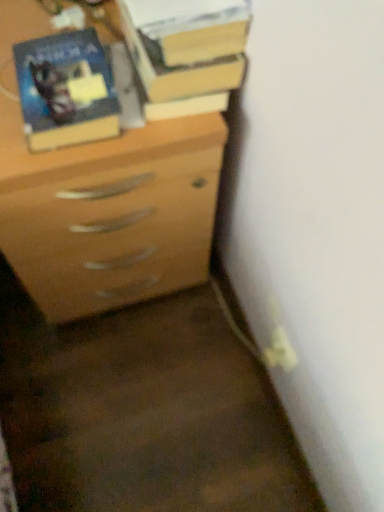
Where is `matte black book at upper left`? The image size is (384, 512). matte black book at upper left is located at coordinates (66, 90).

From the picture: Measure the distance between matte black book at upper left and camera.

The distance of matte black book at upper left from camera is 24.69 inches.

This screenshot has width=384, height=512. What do you see at coordinates (186, 52) in the screenshot? I see `hardcover book at upper center` at bounding box center [186, 52].

Identify the location of matte wood chest of drawers at center. The image size is (384, 512). (109, 213).

Who is smaller, matte wood chest of drawers at center or hardcover book at upper center?

Smaller between the two is hardcover book at upper center.

Measure the distance from matte wood chest of drawers at center to hardcover book at upper center.

A distance of 9.17 inches exists between matte wood chest of drawers at center and hardcover book at upper center.

At what (x,y) coordinates should I click in order to perform the action: click on book that is behind the matte wood chest of drawers at center. Please return your answer as a coordinate pair (x, y). The height and width of the screenshot is (512, 384). Looking at the image, I should click on (186, 52).

Which of these two, matte wood chest of drawers at center or matte black book at upper left, is smaller?

With smaller size is matte black book at upper left.

Consider the image. Is matte wood chest of drawers at center touching matte black book at upper left?

matte wood chest of drawers at center and matte black book at upper left are not in contact.

Is matte wood chest of drawers at center aimed at matte black book at upper left?

No.

Can you tell me how much matte black book at upper left and matte wood chest of drawers at center differ in facing direction?

The angular difference between matte black book at upper left and matte wood chest of drawers at center is 0.149 degrees.

Based on the photo, is matte black book at upper left not within matte wood chest of drawers at center?

Yes, matte black book at upper left is not within matte wood chest of drawers at center.

Who is shorter, matte black book at upper left or matte wood chest of drawers at center?

matte black book at upper left.

Does matte black book at upper left have a greater width compared to matte wood chest of drawers at center?

Incorrect, the width of matte black book at upper left does not surpass that of matte wood chest of drawers at center.

Would you say matte black book at upper left is a long distance from hardcover book at upper center?

They are positioned close to each other.

Can hardcover book at upper center be found inside matte black book at upper left?

Actually, hardcover book at upper center is outside matte black book at upper left.

Is matte black book at upper left to the right of hardcover book at upper center from the viewer's perspective?

No.

Can you tell me how much hardcover book at upper center and matte wood chest of drawers at center differ in facing direction?

The facing directions of hardcover book at upper center and matte wood chest of drawers at center are 0.437 degrees apart.

Considering the sizes of objects hardcover book at upper center and matte wood chest of drawers at center in the image provided, who is smaller, hardcover book at upper center or matte wood chest of drawers at center?

hardcover book at upper center.

Could you tell me if hardcover book at upper center is turned towards matte wood chest of drawers at center?

No, hardcover book at upper center is not oriented towards matte wood chest of drawers at center.

Which object is closer to the camera, hardcover book at upper center or matte wood chest of drawers at center?

matte wood chest of drawers at center is in front.

Is hardcover book at upper center closer to camera compared to matte black book at upper left?

No, hardcover book at upper center is behind matte black book at upper left.

Looking at this image, is hardcover book at upper center wider or thinner than matte black book at upper left?

In the image, hardcover book at upper center appears to be wider than matte black book at upper left.

Is hardcover book at upper center situated inside matte black book at upper left or outside?

hardcover book at upper center lies outside matte black book at upper left.

This screenshot has width=384, height=512. I want to click on book behind the matte wood chest of drawers at center, so click(186, 52).

Where is `chest of drawers below the matte black book at upper left (from a real-world perspective)`? This screenshot has height=512, width=384. chest of drawers below the matte black book at upper left (from a real-world perspective) is located at coordinates (109, 213).

Consider the image. Looking at the image, which one is located closer to hardcover book at upper center, matte wood chest of drawers at center or matte black book at upper left?

matte black book at upper left.

Based on their spatial positions, is matte wood chest of drawers at center or hardcover book at upper center closer to matte black book at upper left?

hardcover book at upper center.

From the image, which object appears to be nearer to hardcover book at upper center, matte black book at upper left or matte wood chest of drawers at center?

The object closer to hardcover book at upper center is matte black book at upper left.

Looking at the image, which one is located further to matte black book at upper left, hardcover book at upper center or matte wood chest of drawers at center?

Among the two, matte wood chest of drawers at center is located further to matte black book at upper left.

Looking at the image, which one is located closer to matte wood chest of drawers at center, hardcover book at upper center or matte black book at upper left?

The object closer to matte wood chest of drawers at center is matte black book at upper left.

Which object lies further to the anchor point matte wood chest of drawers at center, matte black book at upper left or hardcover book at upper center?

Among the two, hardcover book at upper center is located further to matte wood chest of drawers at center.

Where is `paperback book that lies between hardcover book at upper center and matte wood chest of drawers at center from top to bottom`? This screenshot has width=384, height=512. paperback book that lies between hardcover book at upper center and matte wood chest of drawers at center from top to bottom is located at coordinates point(66,90).